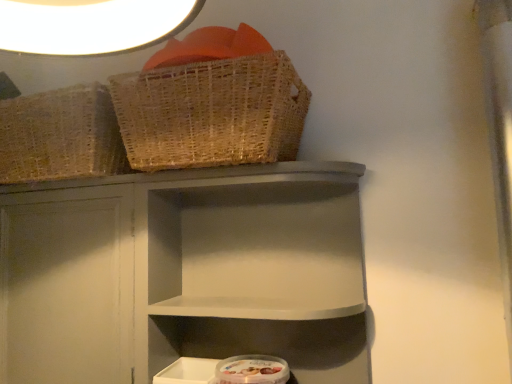
In order to face woven natural basket at upper center, should I rotate leftwards or rightwards?

It's best to rotate left around 5.743 degrees.

Measure the distance between point [269,99] and camera.

Point [269,99] and camera are 81.90 centimeters apart from each other.

The image size is (512, 384). I want to click on woven natural basket at upper center, so click(211, 113).

What do you see at coordinates (211, 113) in the screenshot? The height and width of the screenshot is (384, 512). I see `woven natural basket at upper center` at bounding box center [211, 113].

Locate an element on the screen. The image size is (512, 384). matte gray shelf at center is located at coordinates (186, 271).

What do you see at coordinates (186, 271) in the screenshot?
I see `matte gray shelf at center` at bounding box center [186, 271].

This screenshot has width=512, height=384. What are the coordinates of `woven natural basket at upper center` in the screenshot? It's located at (211, 113).

Can you confirm if woven natural basket at upper center is positioned to the right of matte gray shelf at center?

In fact, woven natural basket at upper center is to the left of matte gray shelf at center.

Which is in front, woven natural basket at upper center or matte gray shelf at center?

Positioned in front is woven natural basket at upper center.

Is point (228, 111) behind point (34, 187)?

That is False.

From the image's perspective, between woven natural basket at upper center and matte gray shelf at center, which one is located above?

woven natural basket at upper center is shown above in the image.

From a real-world perspective, is woven natural basket at upper center physically above matte gray shelf at center?

Yes.

Is woven natural basket at upper center wider than matte gray shelf at center?

Indeed, woven natural basket at upper center has a greater width compared to matte gray shelf at center.

Does woven natural basket at upper center have a lesser height compared to matte gray shelf at center?

Correct, woven natural basket at upper center is not as tall as matte gray shelf at center.

Considering the sizes of objects woven natural basket at upper center and matte gray shelf at center in the image provided, who is bigger, woven natural basket at upper center or matte gray shelf at center?

matte gray shelf at center is bigger.

Would you say woven natural basket at upper center is inside or outside matte gray shelf at center?

woven natural basket at upper center exists outside the volume of matte gray shelf at center.

Looking at this image, is woven natural basket at upper center directly adjacent to matte gray shelf at center?

No, woven natural basket at upper center is not with matte gray shelf at center.

Could you tell me if woven natural basket at upper center is facing matte gray shelf at center?

No, woven natural basket at upper center is not oriented towards matte gray shelf at center.

What's the angular difference between woven natural basket at upper center and matte gray shelf at center's facing directions?

0.277 degrees separate the facing orientations of woven natural basket at upper center and matte gray shelf at center.

Locate an element on the screen. This screenshot has width=512, height=384. shelf that appears on the right of woven natural basket at upper center is located at coordinates (186, 271).

Between matte gray shelf at center and woven natural basket at upper center, which one appears on the left side from the viewer's perspective?

Positioned to the left is woven natural basket at upper center.

Relative to woven natural basket at upper center, is matte gray shelf at center in front or behind?

In the image, matte gray shelf at center appears behind woven natural basket at upper center.

Which is closer to the camera, (306, 334) or (270, 79)?

The point (270, 79) is closer to the camera.

From the image's perspective, which is above, matte gray shelf at center or woven natural basket at upper center?

woven natural basket at upper center.

From a real-world perspective, which is physically above, matte gray shelf at center or woven natural basket at upper center?

woven natural basket at upper center, from a real-world perspective.

Between matte gray shelf at center and woven natural basket at upper center, which one has smaller width?

Thinner between the two is matte gray shelf at center.

Considering the sizes of matte gray shelf at center and woven natural basket at upper center in the image, is matte gray shelf at center taller or shorter than woven natural basket at upper center?

Clearly, matte gray shelf at center is taller compared to woven natural basket at upper center.

Is matte gray shelf at center bigger or smaller than woven natural basket at upper center?

Clearly, matte gray shelf at center is larger in size than woven natural basket at upper center.

Do you think matte gray shelf at center is within woven natural basket at upper center, or outside of it?

matte gray shelf at center lies outside woven natural basket at upper center.

Is matte gray shelf at center far from woven natural basket at upper center?

They are positioned close to each other.

Is matte gray shelf at center positioned with its back to woven natural basket at upper center?

matte gray shelf at center is not turned away from woven natural basket at upper center.

How much distance is there between matte gray shelf at center and woven natural basket at upper center?

24.40 centimeters.

Locate an element on the screen. shelf lying behind the woven natural basket at upper center is located at coordinates (186, 271).

Identify the location of shelf behind the woven natural basket at upper center. The width and height of the screenshot is (512, 384). (186, 271).

You are a GUI agent. You are given a task and a screenshot of the screen. Output one action in this format:
    pyautogui.click(x=<x>, y=<y>)
    Task: Click on the basket located above the matte gray shelf at center (from the image's perspective)
    This screenshot has height=384, width=512.
    Given the screenshot: What is the action you would take?
    pyautogui.click(x=211, y=113)